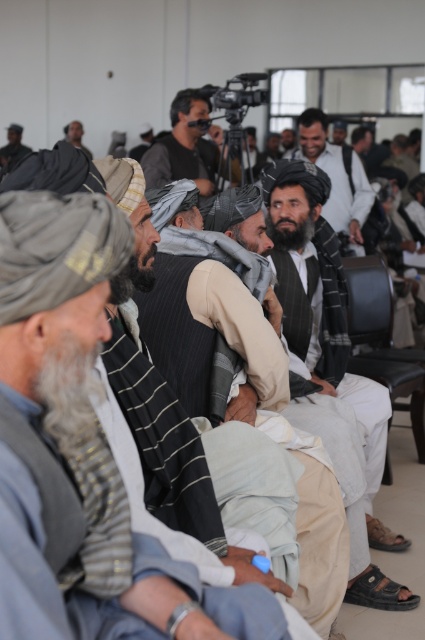
Can you confirm if light brown woolen scarf at center is shorter than dark gray woolen turban at upper left?

Yes.

Is light brown woolen scarf at center in front of dark gray woolen turban at upper left?

No, light brown woolen scarf at center is behind dark gray woolen turban at upper left.

Between point (340, 184) and point (13, 124), which one is positioned behind?

Positioned behind is point (13, 124).

Identify the location of light brown woolen scarf at center. The height and width of the screenshot is (640, 425). (336, 176).

Can you confirm if matte black camera at center is positioned to the right of dark gray woolen turban at upper left?

Indeed, matte black camera at center is positioned on the right side of dark gray woolen turban at upper left.

The height and width of the screenshot is (640, 425). Find the location of `matte black camera at center`. matte black camera at center is located at coordinates (184, 145).

Does light beige fabric at center have a greater width compared to matte black camera at center?

No, light beige fabric at center is not wider than matte black camera at center.

Who is higher up, light beige fabric at center or matte black camera at center?

matte black camera at center is higher up.

The image size is (425, 640). I want to click on light beige fabric at center, so click(47, 576).